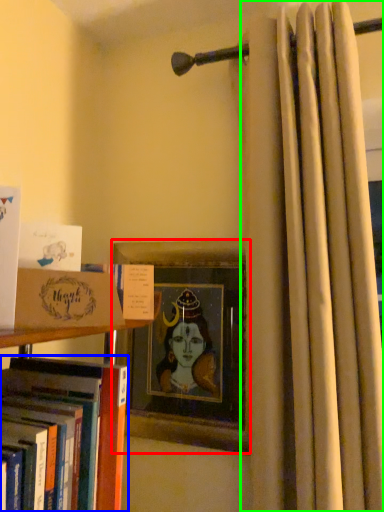
Question: Considering the real-world distances, which object is farthest from picture frame (highlighted by a red box)? book (highlighted by a blue box) or curtain (highlighted by a green box)?

Choices:
 (A) book
 (B) curtain

Answer: (A)